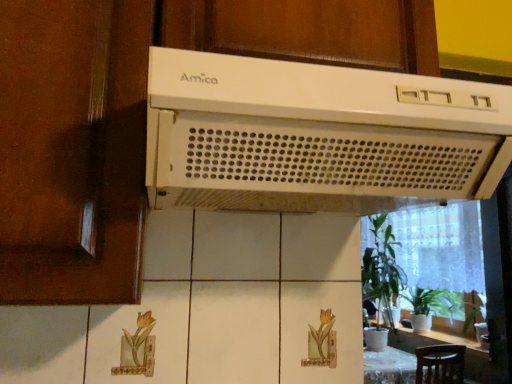
Locate an element on the screen. matte brown screen door at left is located at coordinates (72, 149).

This screenshot has height=384, width=512. What are the coordinates of `green glossy houseplant at lower right, which is the 1th houseplant in right-to-left order` in the screenshot? It's located at (429, 306).

What do you see at coordinates (429, 306) in the screenshot? I see `green glossy houseplant at lower right, positioned as the 2th houseplant in left-to-right order` at bounding box center [429, 306].

The width and height of the screenshot is (512, 384). Find the location of `green leafy plant at right, arranged as the 1th houseplant when viewed from the left`. green leafy plant at right, arranged as the 1th houseplant when viewed from the left is located at coordinates (382, 268).

Considering the positions of objects white plastic amica range hood at upper center and white plastic range hood at upper center in the image provided, who is more to the left, white plastic amica range hood at upper center or white plastic range hood at upper center?

white plastic amica range hood at upper center.

Considering the sizes of objects white plastic amica range hood at upper center and white plastic range hood at upper center in the image provided, who is shorter, white plastic amica range hood at upper center or white plastic range hood at upper center?

Standing shorter between the two is white plastic range hood at upper center.

From a real-world perspective, is white plastic amica range hood at upper center positioned under white plastic range hood at upper center based on gravity?

No, from a real-world perspective, white plastic amica range hood at upper center is not below white plastic range hood at upper center.

Which of these two, white plastic range hood at upper center or green leafy plant at right, acting as the 2th houseplant starting from the right, is smaller?

Smaller between the two is white plastic range hood at upper center.

Could you tell me if white plastic range hood at upper center is turned towards green leafy plant at right, acting as the 2th houseplant starting from the right?

No, white plastic range hood at upper center is not turned towards green leafy plant at right, acting as the 2th houseplant starting from the right.

Is white plastic range hood at upper center wider than green leafy plant at right, acting as the 2th houseplant starting from the right?

No.

Considering the relative positions of white plastic range hood at upper center and green leafy plant at right, arranged as the 1th houseplant when viewed from the left, in the image provided, is white plastic range hood at upper center to the left or to the right of green leafy plant at right, arranged as the 1th houseplant when viewed from the left,?

From the image, it's evident that white plastic range hood at upper center is to the left of green leafy plant at right, arranged as the 1th houseplant when viewed from the left.

Is green leafy plant at right, arranged as the 1th houseplant when viewed from the left, in front of or behind white plastic amica range hood at upper center in the image?

green leafy plant at right, arranged as the 1th houseplant when viewed from the left, is behind white plastic amica range hood at upper center.

From the image's perspective, which object appears higher, green leafy plant at right, acting as the 2th houseplant starting from the right, or white plastic amica range hood at upper center?

white plastic amica range hood at upper center is shown above in the image.

Does point (381, 223) lie in front of point (371, 21)?

No, (381, 223) is behind (371, 21).

Between point (392, 119) and point (423, 320), which one is positioned in front?

Positioned in front is point (392, 119).

Is white plastic range hood at upper center not close to green glossy houseplant at lower right, positioned as the 2th houseplant in left-to-right order?

Yes.

From the image's perspective, is white plastic range hood at upper center under green glossy houseplant at lower right, positioned as the 2th houseplant in left-to-right order?

No, from the image's perspective, white plastic range hood at upper center is not below green glossy houseplant at lower right, positioned as the 2th houseplant in left-to-right order.

Which object is closer to the camera, white plastic range hood at upper center or green glossy houseplant at lower right, which is the 1th houseplant in right-to-left order?

white plastic range hood at upper center is in front.

Can you confirm if white plastic amica range hood at upper center is bigger than green glossy houseplant at lower right, which is the 1th houseplant in right-to-left order?

Correct, white plastic amica range hood at upper center is larger in size than green glossy houseplant at lower right, which is the 1th houseplant in right-to-left order.

From the image's perspective, between white plastic amica range hood at upper center and green glossy houseplant at lower right, positioned as the 2th houseplant in left-to-right order, who is located below?

From the image's view, green glossy houseplant at lower right, positioned as the 2th houseplant in left-to-right order, is below.

Is white plastic amica range hood at upper center wider than green glossy houseplant at lower right, which is the 1th houseplant in right-to-left order?

Yes, white plastic amica range hood at upper center is wider than green glossy houseplant at lower right, which is the 1th houseplant in right-to-left order.

Considering the sizes of objects green leafy plant at right, arranged as the 1th houseplant when viewed from the left, and matte brown screen door at left in the image provided, who is bigger, green leafy plant at right, arranged as the 1th houseplant when viewed from the left, or matte brown screen door at left?

green leafy plant at right, arranged as the 1th houseplant when viewed from the left, is bigger.

Are green leafy plant at right, acting as the 2th houseplant starting from the right, and matte brown screen door at left beside each other?

No, green leafy plant at right, acting as the 2th houseplant starting from the right, is not with matte brown screen door at left.

Is the position of green leafy plant at right, arranged as the 1th houseplant when viewed from the left, more distant than that of matte brown screen door at left?

Yes, green leafy plant at right, arranged as the 1th houseplant when viewed from the left, is further from the camera.

Does green leafy plant at right, acting as the 2th houseplant starting from the right, contain matte brown screen door at left?

Actually, matte brown screen door at left is outside green leafy plant at right, acting as the 2th houseplant starting from the right.

From the image's perspective, does green glossy houseplant at lower right, positioned as the 2th houseplant in left-to-right order, appear lower than green leafy plant at right, acting as the 2th houseplant starting from the right?

Yes, from the image's perspective, green glossy houseplant at lower right, positioned as the 2th houseplant in left-to-right order, is below green leafy plant at right, acting as the 2th houseplant starting from the right.

Is green glossy houseplant at lower right, positioned as the 2th houseplant in left-to-right order, positioned with its back to green leafy plant at right, arranged as the 1th houseplant when viewed from the left?

green glossy houseplant at lower right, positioned as the 2th houseplant in left-to-right order, does not have its back to green leafy plant at right, arranged as the 1th houseplant when viewed from the left.

Is green glossy houseplant at lower right, which is the 1th houseplant in right-to-left order, shorter than green leafy plant at right, acting as the 2th houseplant starting from the right?

A: Correct, green glossy houseplant at lower right, which is the 1th houseplant in right-to-left order, is not as tall as green leafy plant at right, acting as the 2th houseplant starting from the right.

Is green glossy houseplant at lower right, which is the 1th houseplant in right-to-left order, not close to green leafy plant at right, arranged as the 1th houseplant when viewed from the left?

They are positioned close to each other.

The height and width of the screenshot is (384, 512). What are the coordinates of `home appliance in front of the white plastic amica range hood at upper center` in the screenshot? It's located at pyautogui.click(x=317, y=135).

The width and height of the screenshot is (512, 384). Identify the location of home appliance above the green leafy plant at right, acting as the 2th houseplant starting from the right (from the image's perspective). (317, 135).

From the image, which object appears to be nearer to white plastic range hood at upper center, green leafy plant at right, arranged as the 1th houseplant when viewed from the left, or green glossy houseplant at lower right, positioned as the 2th houseplant in left-to-right order?

green leafy plant at right, arranged as the 1th houseplant when viewed from the left.

When comparing their distances from green glossy houseplant at lower right, which is the 1th houseplant in right-to-left order, does matte brown screen door at left or green leafy plant at right, acting as the 2th houseplant starting from the right, seem closer?

green leafy plant at right, acting as the 2th houseplant starting from the right, lies closer to green glossy houseplant at lower right, which is the 1th houseplant in right-to-left order, than the other object.

Which object lies nearer to the anchor point green glossy houseplant at lower right, which is the 1th houseplant in right-to-left order, white plastic range hood at upper center or green leafy plant at right, arranged as the 1th houseplant when viewed from the left?

The object closer to green glossy houseplant at lower right, which is the 1th houseplant in right-to-left order, is green leafy plant at right, arranged as the 1th houseplant when viewed from the left.

Based on their spatial positions, is white plastic range hood at upper center or white plastic amica range hood at upper center closer to matte brown screen door at left?

white plastic range hood at upper center lies closer to matte brown screen door at left than the other object.

When comparing their distances from white plastic amica range hood at upper center, does matte brown screen door at left or white plastic range hood at upper center seem closer?

white plastic range hood at upper center is closer to white plastic amica range hood at upper center.

Estimate the real-world distances between objects in this image. Which object is further from green leafy plant at right, acting as the 2th houseplant starting from the right, matte brown screen door at left or green glossy houseplant at lower right, which is the 1th houseplant in right-to-left order?

matte brown screen door at left lies further to green leafy plant at right, acting as the 2th houseplant starting from the right, than the other object.

Which object lies further to the anchor point green leafy plant at right, arranged as the 1th houseplant when viewed from the left, green glossy houseplant at lower right, which is the 1th houseplant in right-to-left order, or white plastic range hood at upper center?

white plastic range hood at upper center.

Considering their positions, is white plastic range hood at upper center positioned further to white plastic amica range hood at upper center than green leafy plant at right, arranged as the 1th houseplant when viewed from the left?

The object further to white plastic amica range hood at upper center is green leafy plant at right, arranged as the 1th houseplant when viewed from the left.

Find the location of a particular element. cabinetry located between white plastic range hood at upper center and green glossy houseplant at lower right, which is the 1th houseplant in right-to-left order, in the depth direction is located at coordinates (309, 31).

In order to click on cabinetry between matte brown screen door at left and white plastic range hood at upper center from left to right in this screenshot , I will do `click(309, 31)`.

The height and width of the screenshot is (384, 512). What are the coordinates of `houseplant between white plastic range hood at upper center and green leafy plant at right, arranged as the 1th houseplant when viewed from the left, from front to back` in the screenshot? It's located at (429, 306).

You are a GUI agent. You are given a task and a screenshot of the screen. Output one action in this format:
    pyautogui.click(x=<x>, y=<y>)
    Task: Click on the screen door between white plastic range hood at upper center and green leafy plant at right, arranged as the 1th houseplant when viewed from the left, along the z-axis
    The height and width of the screenshot is (384, 512).
    Given the screenshot: What is the action you would take?
    pyautogui.click(x=72, y=149)